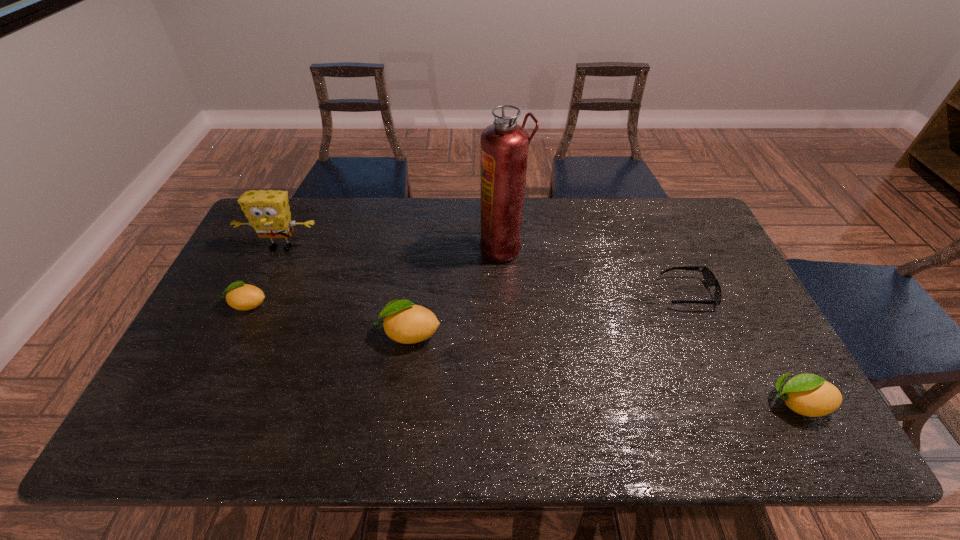
Locate an element on the screen. The height and width of the screenshot is (540, 960). free space located with leaves positioned above the second farthest lemon is located at coordinates (351, 333).

Image resolution: width=960 pixels, height=540 pixels. In order to click on vacant space located 0.260m with leaves positioned above the second farthest lemon in this screenshot , I will do [x=280, y=333].

Locate an element on the screen. This screenshot has width=960, height=540. vacant space located 0.300m with leaves positioned above the second farthest lemon is located at coordinates (266, 333).

I want to click on free spot located with leaves positioned above the rightmost lemon, so click(x=601, y=403).

At what (x,y) coordinates should I click in order to perform the action: click on vacant area located with leaves positioned above the rightmost lemon. Please return your answer as a coordinate pair (x, y). Image resolution: width=960 pixels, height=540 pixels. Looking at the image, I should click on (664, 403).

This screenshot has width=960, height=540. Find the location of `free space located with leaves positioned above the rightmost lemon`. free space located with leaves positioned above the rightmost lemon is located at coordinates (689, 403).

The image size is (960, 540). In order to click on vacant space situated 0.170m on the front-facing side of the sunglasses in this screenshot , I will do `click(605, 293)`.

I want to click on free space located 0.200m on the front-facing side of the sunglasses, so click(x=594, y=293).

Image resolution: width=960 pixels, height=540 pixels. I want to click on blank area located 0.080m on the front-facing side of the sunglasses, so click(636, 293).

Locate an element on the screen. This screenshot has width=960, height=540. free region located on the side of the third object from right to left with the label is located at coordinates (455, 248).